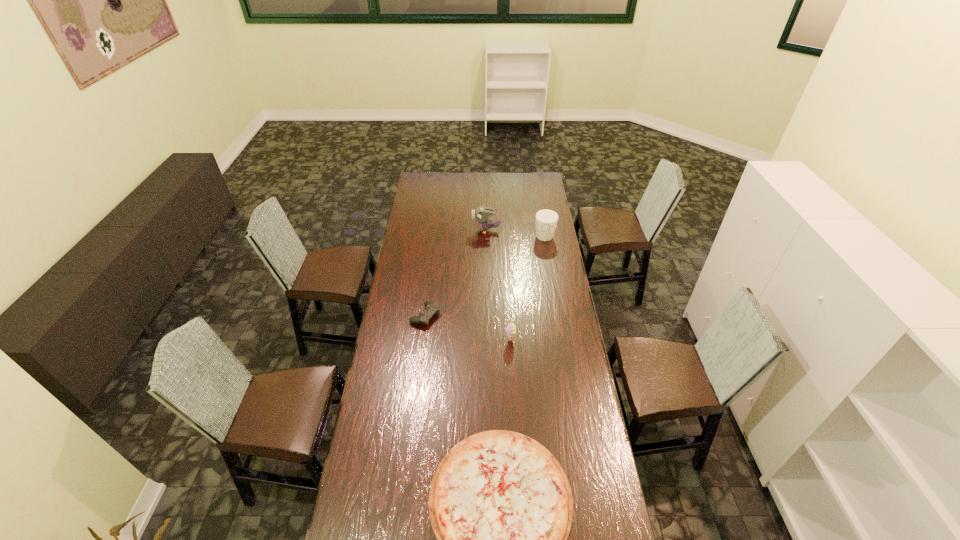
The image size is (960, 540). Identify the location of free space located 0.190m on the right of the fourth farthest object. (559, 340).

Where is `vacant space located 0.120m on the back of the leftmost object`? vacant space located 0.120m on the back of the leftmost object is located at coordinates (429, 286).

The image size is (960, 540). Find the location of `object situated at the left edge`. object situated at the left edge is located at coordinates (431, 308).

You are a GUI agent. You are given a task and a screenshot of the screen. Output one action in this format:
    pyautogui.click(x=<x>, y=<y>)
    Task: Click on the object at the right edge
    
    Given the screenshot: What is the action you would take?
    pyautogui.click(x=546, y=220)

Image resolution: width=960 pixels, height=540 pixels. I want to click on free space at the far edge, so click(463, 173).

You are a GUI agent. You are given a task and a screenshot of the screen. Output one action in this format:
    pyautogui.click(x=<x>, y=<y>)
    Task: Click on the vacant area at the left edge of the desktop
    
    Given the screenshot: What is the action you would take?
    pyautogui.click(x=420, y=198)

Identify the location of free spot at the right edge of the desktop. (560, 396).

Find the location of a particular element. free space at the far right corner is located at coordinates (545, 187).

Where is `free space that is in between the control and the bird`? This screenshot has width=960, height=540. free space that is in between the control and the bird is located at coordinates 456,273.

Where is `vacant space in between the sherbert and the bird`? vacant space in between the sherbert and the bird is located at coordinates (498, 285).